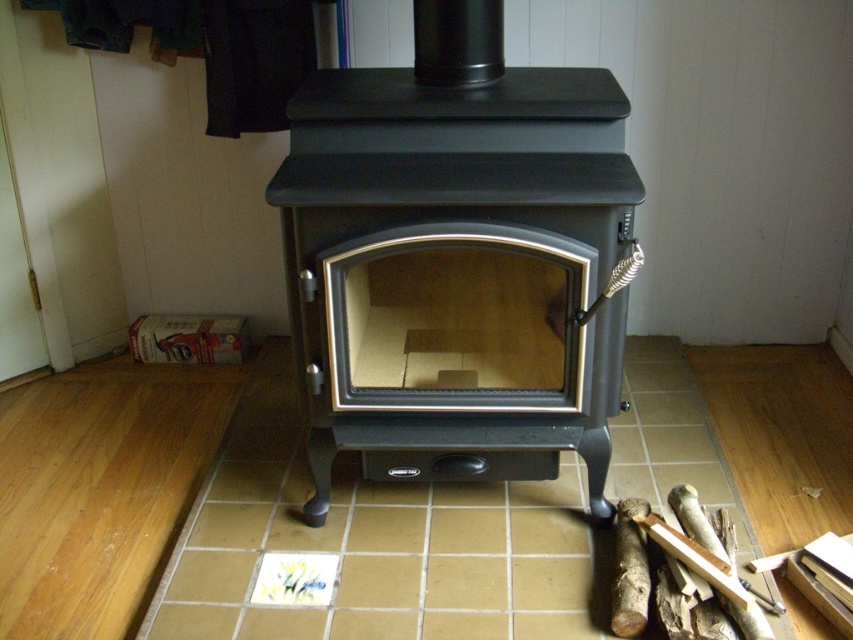
Can you confirm if matte black stove at center is taller than brown wood log at lower right?

Yes.

Which is above, matte black stove at center or brown wood log at lower right?

Positioned higher is matte black stove at center.

Is point (502, 291) positioned before point (639, 518)?

No.

Image resolution: width=853 pixels, height=640 pixels. Identify the location of matte black stove at center. (456, 352).